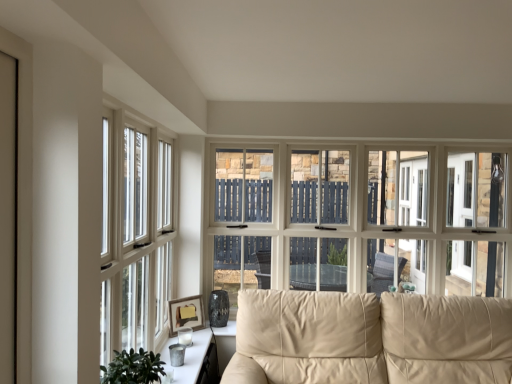
Question: Looking at the image, does metallic silver tray at lower center seem bigger or smaller compared to matte white window at center, arranged as the 2th window when viewed from the front?

Choices:
 (A) big
 (B) small

Answer: (B)

Question: Is metallic silver tray at lower center to the left or to the right of matte white window at center, which is counted as the 2th window, starting from the left, in the image?

Choices:
 (A) right
 (B) left

Answer: (B)

Question: Estimate the real-world distances between objects in this image. Which object is closer to the beige leather couch at center?

Choices:
 (A) green leafy plant at lower left
 (B) matte wooden picture frame at lower left
 (C) matte white window at center, which is counted as the 2th window, starting from the left
 (D) metallic silver tray at lower center
 (E) white wood window at left, placed as the 2th window when sorted from back to front

Answer: (C)

Question: Which object is the farthest from the matte white window at center, which is counted as the 2th window, starting from the left?

Choices:
 (A) white wood window at left, which appears as the first window when viewed from the front
 (B) beige leather couch at center
 (C) green leafy plant at lower left
 (D) metallic silver tray at lower center
 (E) matte wooden picture frame at lower left

Answer: (C)